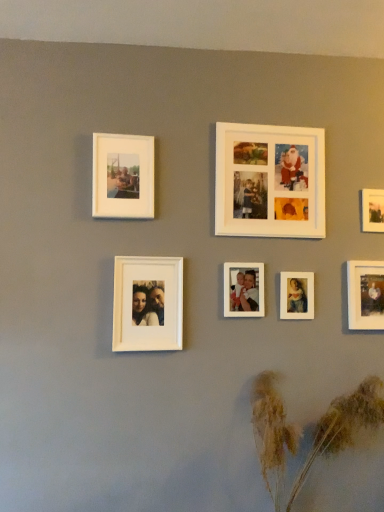
Question: From a real-world perspective, does white matte photo frame at center, arranged as the 3th picture frame when viewed from the left, stand above white matte photo frame at upper center, arranged as the fourth picture frame when viewed from the right?

Choices:
 (A) no
 (B) yes

Answer: (A)

Question: From a real-world perspective, is white matte photo frame at center, arranged as the 3th picture frame when viewed from the left, beneath white matte photo frame at upper center, arranged as the fourth picture frame when viewed from the right?

Choices:
 (A) no
 (B) yes

Answer: (B)

Question: Is white matte photo frame at center, placed as the fifth picture frame when sorted from right to left, further to camera compared to white matte photo frame at upper center, arranged as the fourth picture frame when viewed from the left?

Choices:
 (A) no
 (B) yes

Answer: (B)

Question: Does white matte photo frame at center, arranged as the 3th picture frame when viewed from the left, have a greater width compared to white matte photo frame at upper center, arranged as the fourth picture frame when viewed from the left?

Choices:
 (A) yes
 (B) no

Answer: (B)

Question: Could you tell me if white matte photo frame at center, arranged as the 3th picture frame when viewed from the left, is facing white matte photo frame at upper center, arranged as the fourth picture frame when viewed from the left?

Choices:
 (A) yes
 (B) no

Answer: (B)

Question: Based on their positions, is white matte photo frame at center, acting as the second picture frame starting from the left, located to the left or right of brown textured plant at lower right?

Choices:
 (A) right
 (B) left

Answer: (B)

Question: Relative to brown textured plant at lower right, is white matte photo frame at center, the sixth picture frame from the right, in front or behind?

Choices:
 (A) front
 (B) behind

Answer: (B)

Question: Do you think white matte photo frame at center, the sixth picture frame from the right, is within brown textured plant at lower right, or outside of it?

Choices:
 (A) outside
 (B) inside

Answer: (A)

Question: From a real-world perspective, is white matte photo frame at center, the sixth picture frame from the right, positioned above or below brown textured plant at lower right?

Choices:
 (A) above
 (B) below

Answer: (A)

Question: Is white matte photo frame at center, placed as the fifth picture frame when sorted from right to left, wider or thinner than white matte photo frame at upper left, the first picture frame positioned from the left?

Choices:
 (A) thin
 (B) wide

Answer: (A)

Question: Which is correct: white matte photo frame at center, placed as the fifth picture frame when sorted from right to left, is inside white matte photo frame at upper left, the first picture frame positioned from the left, or outside of it?

Choices:
 (A) outside
 (B) inside

Answer: (A)

Question: From a real-world perspective, is white matte photo frame at center, placed as the fifth picture frame when sorted from right to left, physically located above or below white matte photo frame at upper left, the first picture frame positioned from the left?

Choices:
 (A) below
 (B) above

Answer: (A)

Question: Does point (241, 290) appear closer or farther from the camera than point (117, 194)?

Choices:
 (A) closer
 (B) farther

Answer: (B)

Question: Is matte white photo frame at center right, the third picture frame viewed from the right, wider or thinner than matte white photo frame at upper right, marked as the seventh picture frame in a left-to-right arrangement?

Choices:
 (A) wide
 (B) thin

Answer: (B)

Question: From the image's perspective, is matte white photo frame at center right, the third picture frame viewed from the right, located above or below matte white photo frame at upper right, marked as the seventh picture frame in a left-to-right arrangement?

Choices:
 (A) below
 (B) above

Answer: (A)